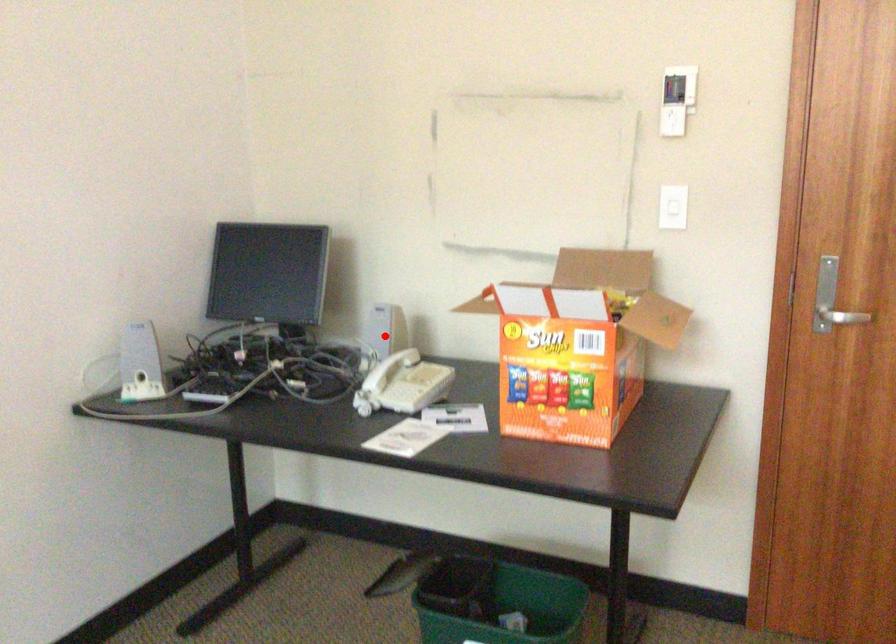
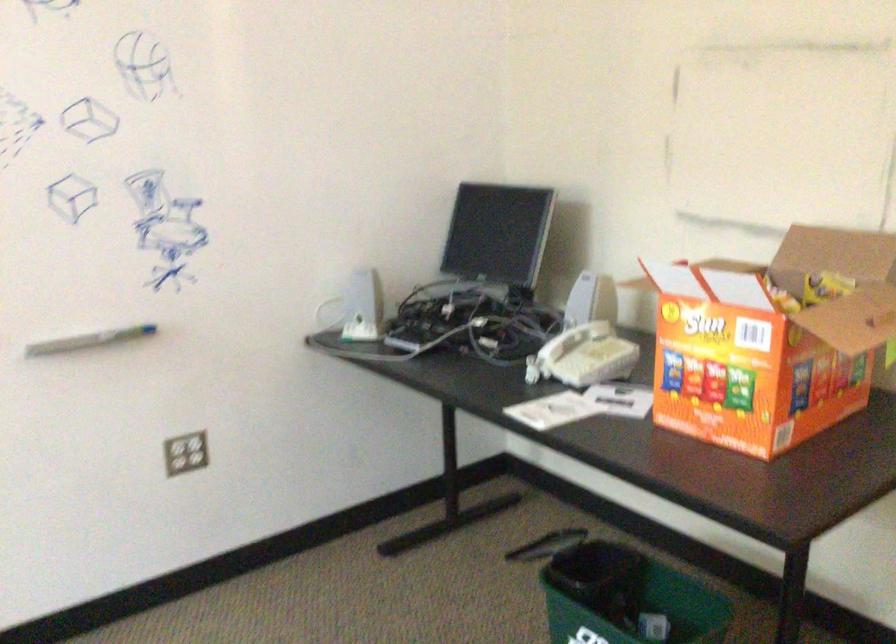
Find the pixel in the second image that matches the highlighted location in the first image.

(579, 305)